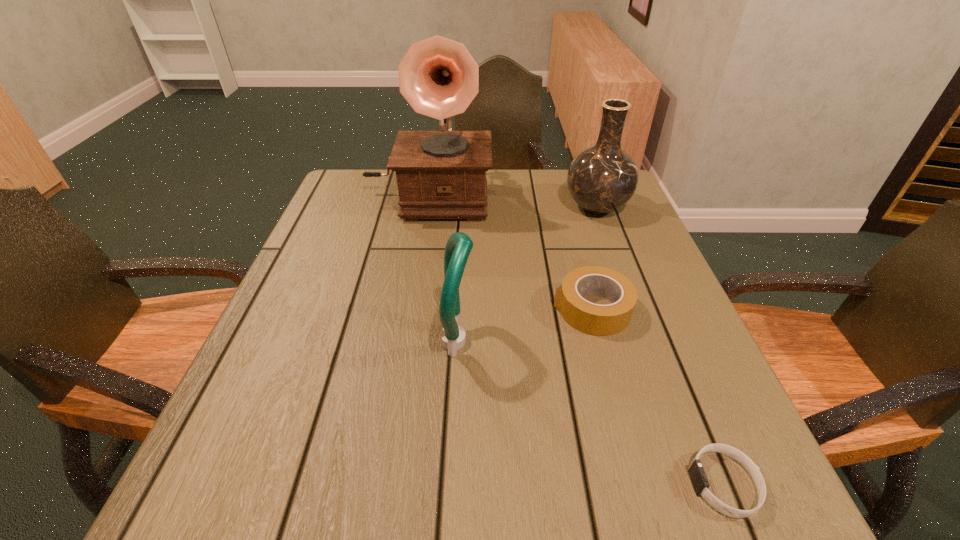
The width and height of the screenshot is (960, 540). I want to click on record player, so pos(441,174).

Where is `vase`? Image resolution: width=960 pixels, height=540 pixels. vase is located at coordinates (601, 179).

Where is `bottle opener`? This screenshot has width=960, height=540. bottle opener is located at coordinates (459, 245).

Locate an element on the screen. the fourth tallest object is located at coordinates (601, 320).

The image size is (960, 540). What are the coordinates of `wristband` in the screenshot? It's located at (697, 474).

Locate an element on the screen. the shortest object is located at coordinates (697, 474).

The height and width of the screenshot is (540, 960). In order to click on free space located 0.200m on the horn of the tallest object in this screenshot , I will do [x=414, y=280].

At what (x,y) coordinates should I click in order to perform the action: click on vacant space located on the left of the vase. Please return your answer as a coordinate pair (x, y). The width and height of the screenshot is (960, 540). Looking at the image, I should click on (529, 207).

At what (x,y) coordinates should I click in order to perform the action: click on blank area located at the jaws of the bottle opener. Please return your answer as a coordinate pair (x, y). The height and width of the screenshot is (540, 960). Looking at the image, I should click on (659, 341).

Where is `vacant space located 0.230m at the edge of the fourth tallest object`? The height and width of the screenshot is (540, 960). vacant space located 0.230m at the edge of the fourth tallest object is located at coordinates (438, 309).